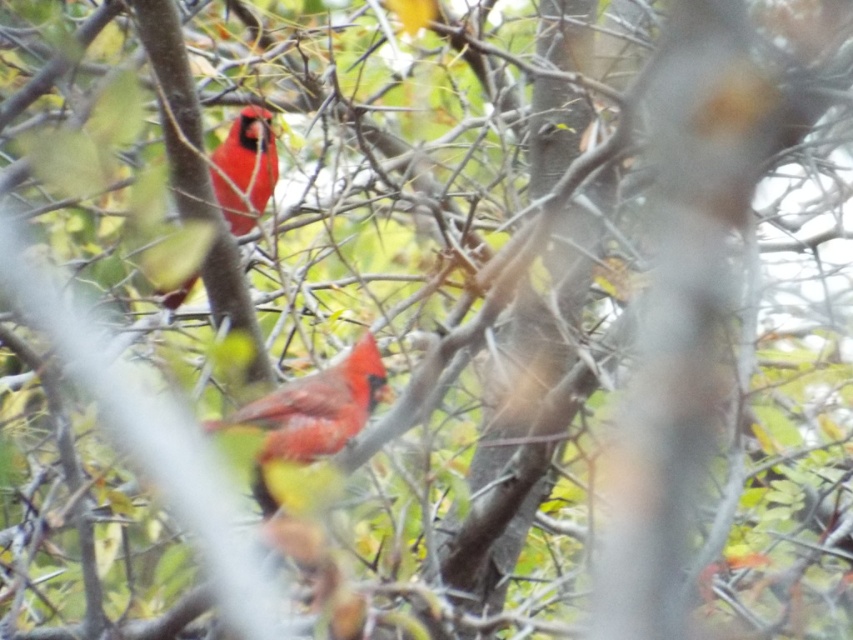
The width and height of the screenshot is (853, 640). Find the location of `matte red cardinal at center`. matte red cardinal at center is located at coordinates (312, 412).

Where is `matte red cardinal at center`? matte red cardinal at center is located at coordinates (312, 412).